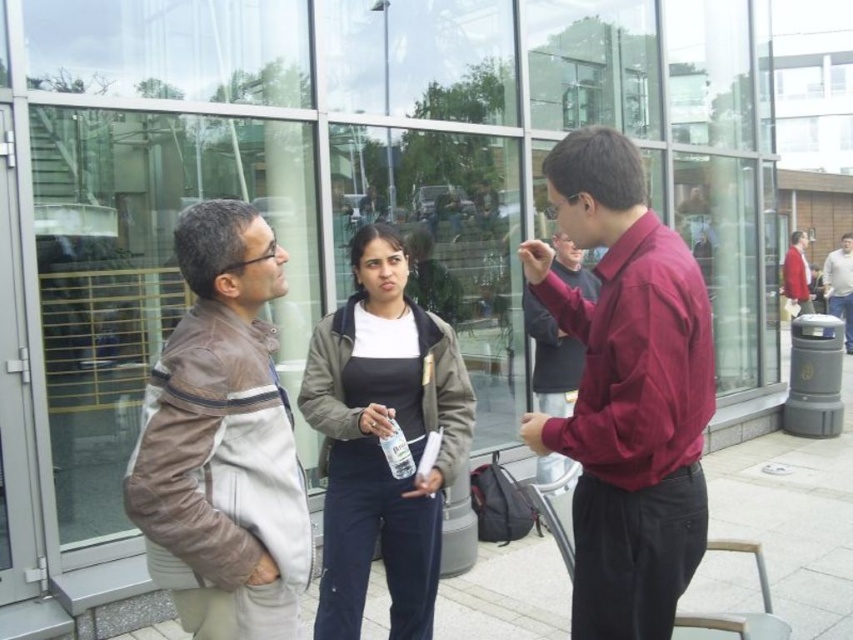
Is the position of brown leather jacket at left more distant than that of dark gray sweater at center?

No, brown leather jacket at left is closer to the viewer.

Does point (265, 528) come behind point (844, 317)?

No, (265, 528) is closer to viewer.

In order to click on brown leather jacket at left in this screenshot , I will do `click(222, 442)`.

Which is behind, point (447, 364) or point (790, 243)?

Positioned behind is point (790, 243).

Is dark green jacket at center above red cotton shirt at right?

No, dark green jacket at center is not above red cotton shirt at right.

Who is more forward, (426, 310) or (788, 282)?

Point (426, 310) is more forward.

I want to click on dark green jacket at center, so click(x=381, y=436).

Can you confirm if brown leather jacket at left is thinner than dark green jacket at center?

Correct, brown leather jacket at left's width is less than dark green jacket at center's.

Can you confirm if brown leather jacket at left is shorter than dark green jacket at center?

Correct, brown leather jacket at left is not as tall as dark green jacket at center.

Locate an element on the screen. brown leather jacket at left is located at coordinates (222, 442).